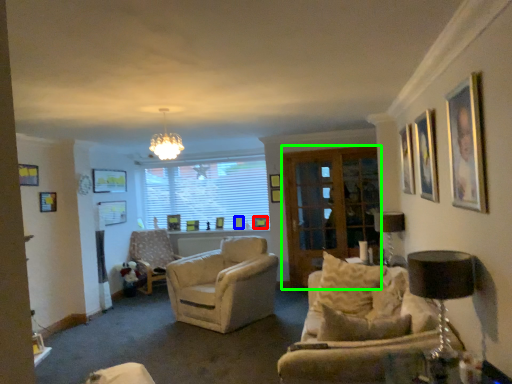
Question: Based on their relative distances, which object is nearer to picture frame (highlighted by a red box)? Choose from picture frame (highlighted by a blue box) and screen door (highlighted by a green box).

Choices:
 (A) picture frame
 (B) screen door

Answer: (A)